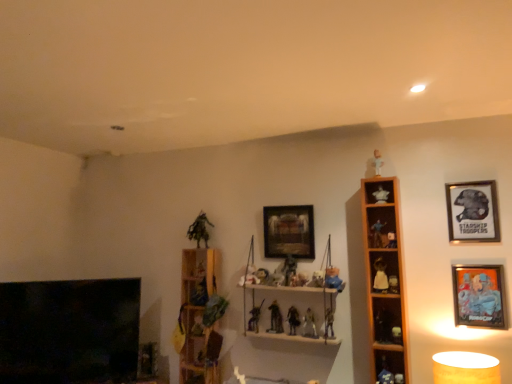
Question: Considering their positions, is matte plastic figurine at center, which is counted as the 19th toy, starting from the right, located in front of or behind metallic silver figurine at upper right, the seventeenth toy in the left-to-right sequence?

Choices:
 (A) front
 (B) behind

Answer: (B)

Question: Based on their sizes in the image, would you say matte plastic figurine at center, the 2th toy viewed from the left, is bigger or smaller than metallic silver figurine at upper right, the seventeenth toy in the left-to-right sequence?

Choices:
 (A) big
 (B) small

Answer: (A)

Question: Estimate the real-world distances between objects in this image. Which object is closer to the white matte figurine at right, the fourteenth toy positioned from the left?

Choices:
 (A) metallic silver figure at center, which is the thirteenth toy in right-to-left order
 (B) black glass fireplace at lower left
 (C) matte plastic action figure at center, acting as the eleventh toy starting from the right
 (D) matte plastic toy at center, arranged as the twentieth toy when viewed from the left
 (E) green matte toy at upper center, which appears as the twentieth toy when viewed from the right

Answer: (D)

Question: Considering the real-world distances, which object is farthest from the black glass fireplace at lower left?

Choices:
 (A) metallic silver picture frame at upper right, which is the second picture frame from back to front
 (B) wooden shelf at right, placed as the 3th shelf when sorted from left to right
 (C) metallic blue figure at upper right, marked as the eighth toy in a right-to-left arrangement
 (D) matte plastic action figure at center-right, placed as the 3th toy when sorted from right to left
 (E) matte plastic toy at center, which appears as the 11th toy when viewed from the left

Answer: (A)